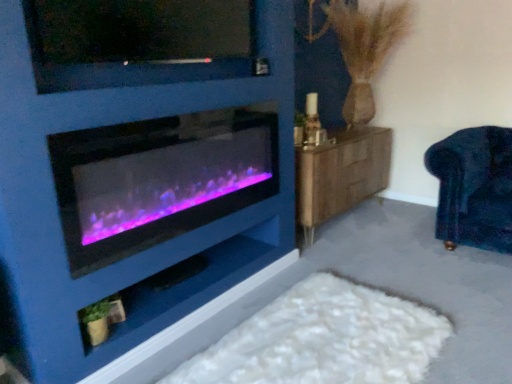
Question: Considering the positions of point (339, 132) and point (201, 258), is point (339, 132) closer or farther from the camera than point (201, 258)?

Choices:
 (A) closer
 (B) farther

Answer: (B)

Question: From a real-world perspective, is wooden dresser at right positioned above or below matte black shelf at lower center?

Choices:
 (A) above
 (B) below

Answer: (A)

Question: Estimate the real-world distances between objects in this image. Which object is farther from the wooden dresser at right?

Choices:
 (A) purple-lit glass wood burning stove at left
 (B) matte black shelf at lower center
 (C) matte black tv at upper center
 (D) white fluffy rug at lower center
 (E) velvet dark blue armchair at right

Answer: (C)

Question: Which object is positioned farthest from the velvet dark blue armchair at right?

Choices:
 (A) purple-lit glass wood burning stove at left
 (B) wooden dresser at right
 (C) matte black shelf at lower center
 (D) white fluffy rug at lower center
 (E) matte black tv at upper center

Answer: (E)